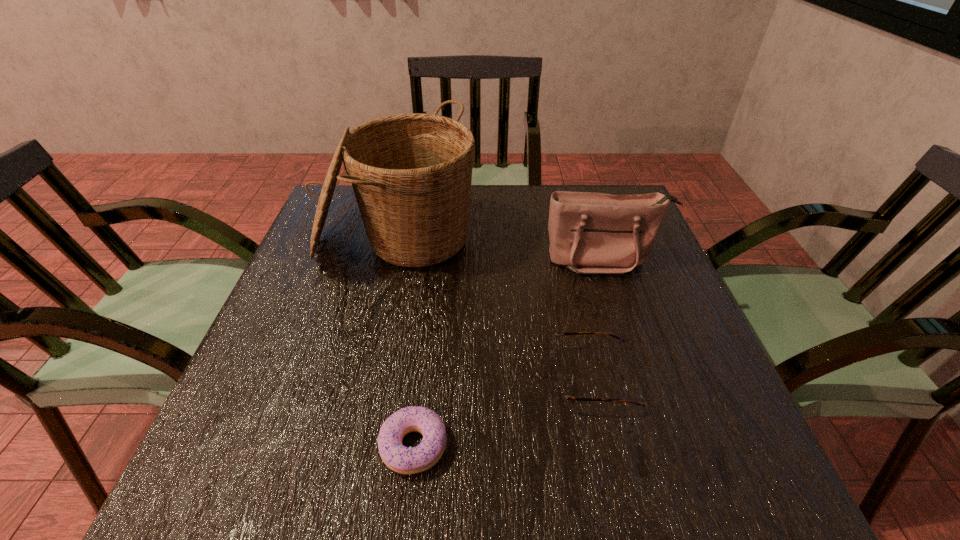
At what (x,y) coordinates should I click in order to perform the action: click on vacant area that lies between the doughnut and the spectacles. Please return your answer as a coordinate pair (x, y). Looking at the image, I should click on (503, 411).

Identify the location of free point between the spectacles and the nearest object. tap(503, 411).

Locate an element on the screen. vacant space that's between the second tallest object and the doughnut is located at coordinates (509, 352).

Where is `vacant region between the shoulder bag and the tallest object`? The width and height of the screenshot is (960, 540). vacant region between the shoulder bag and the tallest object is located at coordinates (500, 249).

Image resolution: width=960 pixels, height=540 pixels. Identify the location of vacant point located between the shoulder bag and the doughnut. (509, 352).

Image resolution: width=960 pixels, height=540 pixels. I want to click on vacant area that lies between the second tallest object and the spectacles, so click(598, 319).

You are a GUI agent. You are given a task and a screenshot of the screen. Output one action in this format:
    pyautogui.click(x=<x>, y=<y>)
    Task: Click on the vacant space that's between the tallest object and the shoulder bag
    The image size is (960, 540).
    Given the screenshot: What is the action you would take?
    pyautogui.click(x=500, y=249)

The width and height of the screenshot is (960, 540). I want to click on free spot between the doughnut and the third shortest object, so click(509, 352).

You are a GUI agent. You are given a task and a screenshot of the screen. Output one action in this format:
    pyautogui.click(x=<x>, y=<y>)
    Task: Click on the blank region between the second tallest object and the basket
    
    Given the screenshot: What is the action you would take?
    pyautogui.click(x=500, y=249)

At what (x,y) coordinates should I click in order to perform the action: click on vacant space that's between the doughnut and the tallest object. Please return your answer as a coordinate pair (x, y). Looking at the image, I should click on (405, 342).